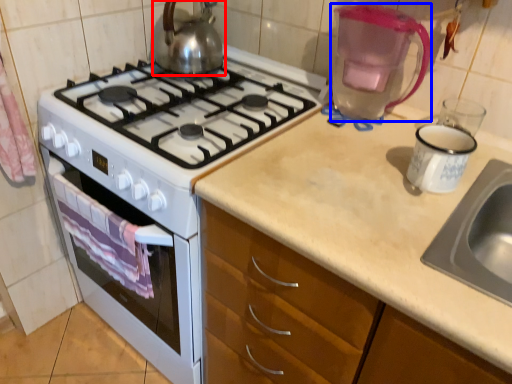
Question: Which of the following is the farthest to the observer, kettle (highlighted by a red box) or coffeepot (highlighted by a blue box)?

Choices:
 (A) kettle
 (B) coffeepot

Answer: (A)